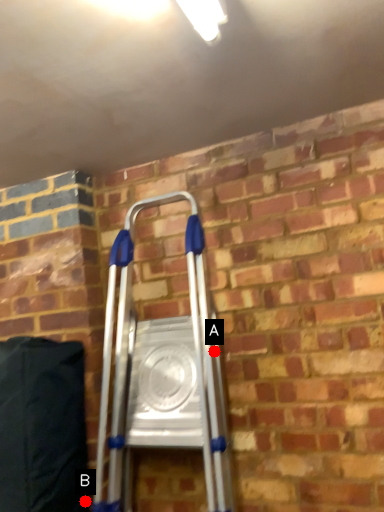
Question: Two points are circled on the image, labeled by A and B beside each circle. Which point appears closest to the camera in this image?

Choices:
 (A) A is closer
 (B) B is closer

Answer: (A)